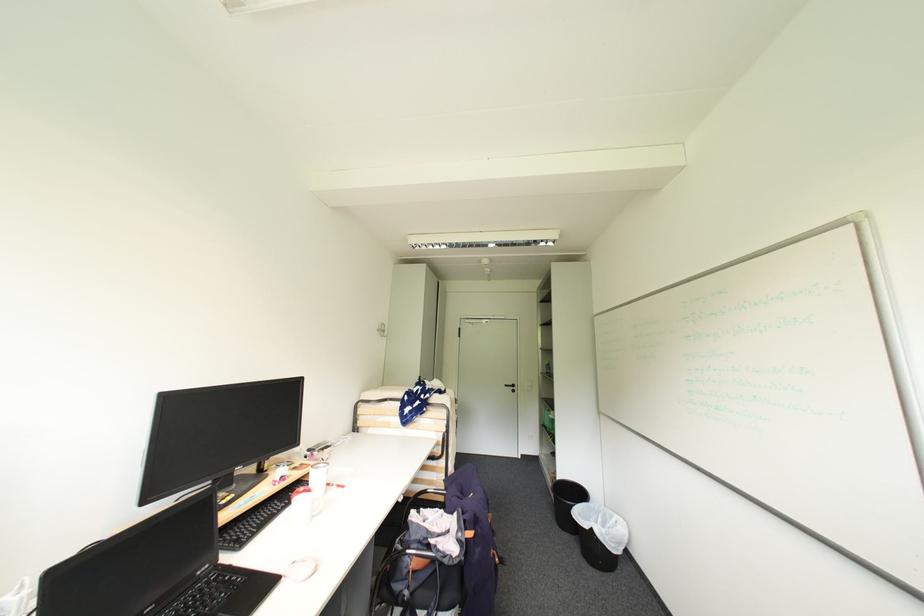
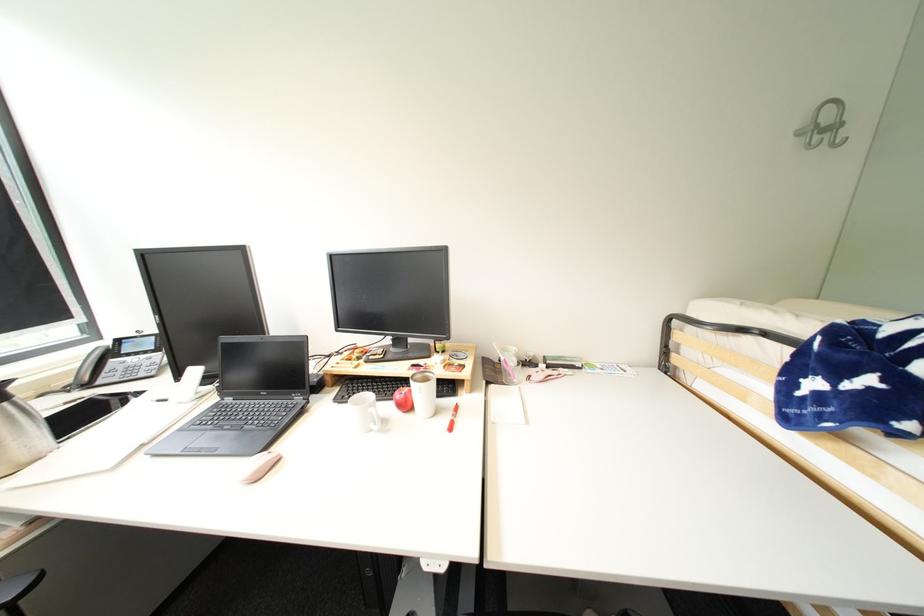
The point at (x=390, y=331) is marked in the first image. Where is the corresponding point in the second image?

(841, 128)